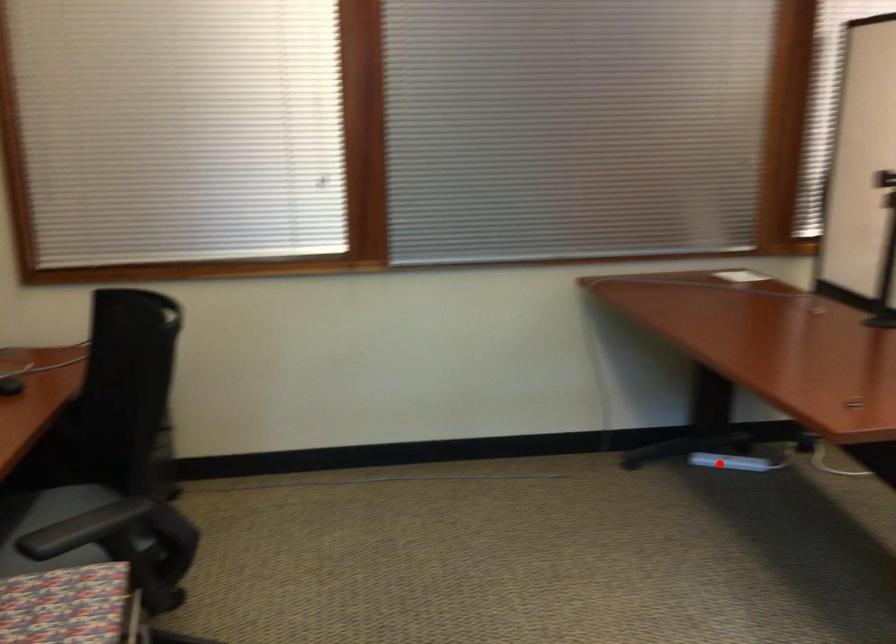
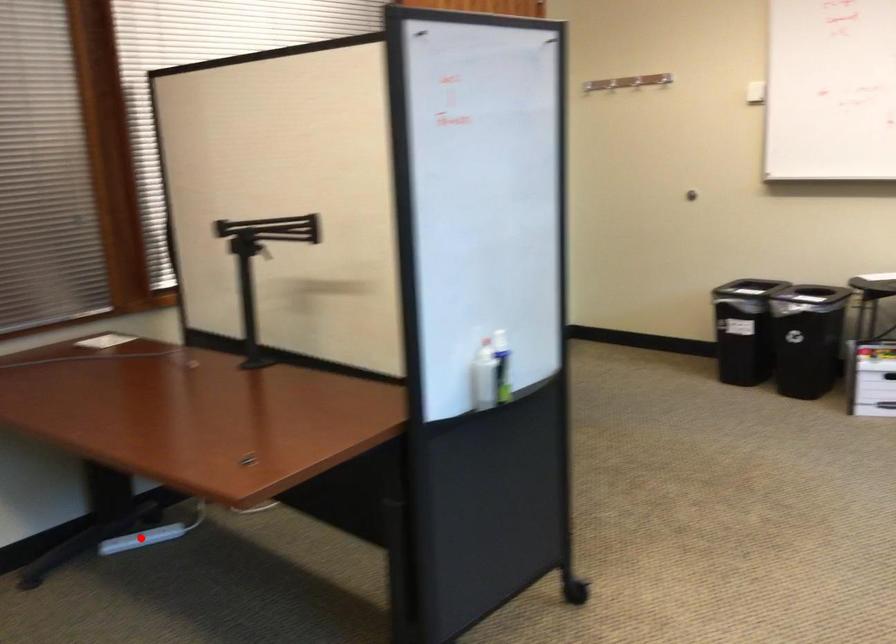
I am providing you with two images of the same scene from different viewpoints. A red point is marked on the first image and another point is marked on the second image. Is the red point in image1 aligned with the point shown in image2?

Yes